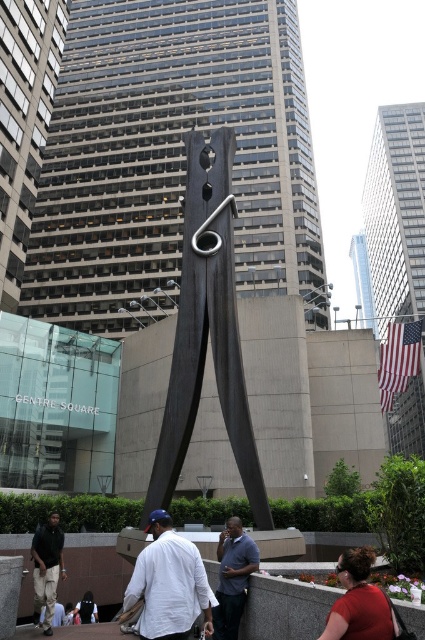
Question: Which point is closer to the camera?

Choices:
 (A) dark blue shirt at center
 (B) white matte shirt at center
 (C) dark wood clothespin at center

Answer: (B)

Question: Which object is positioned closest to the dark gray pants at lower left?

Choices:
 (A) dark blue shirt at center
 (B) white matte shirt at center
 (C) dark wood clothespin at center

Answer: (C)

Question: Estimate the real-world distances between objects in this image. Which object is farther from the dark blue shirt at center?

Choices:
 (A) dark wood clothespin at center
 (B) dark gray pants at lower left
 (C) white matte shirt at center

Answer: (B)

Question: Observing the image, what is the correct spatial positioning of dark wood clothespin at center in reference to dark blue shirt at center?

Choices:
 (A) below
 (B) above

Answer: (B)

Question: Can you confirm if dark wood clothespin at center is wider than white matte shirt at center?

Choices:
 (A) yes
 (B) no

Answer: (A)

Question: Does dark blue shirt at center have a lesser width compared to dark gray pants at lower left?

Choices:
 (A) no
 (B) yes

Answer: (B)